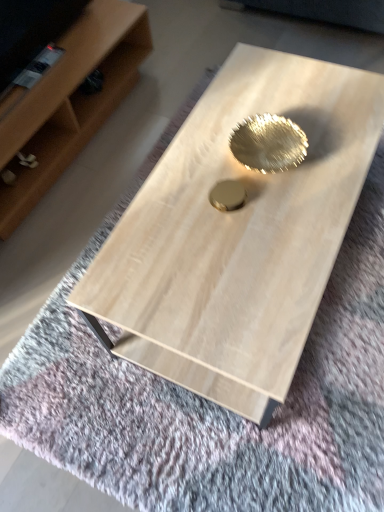
Identify the location of vacant space that is to the left of light wood coffee table at center. (x=69, y=312).